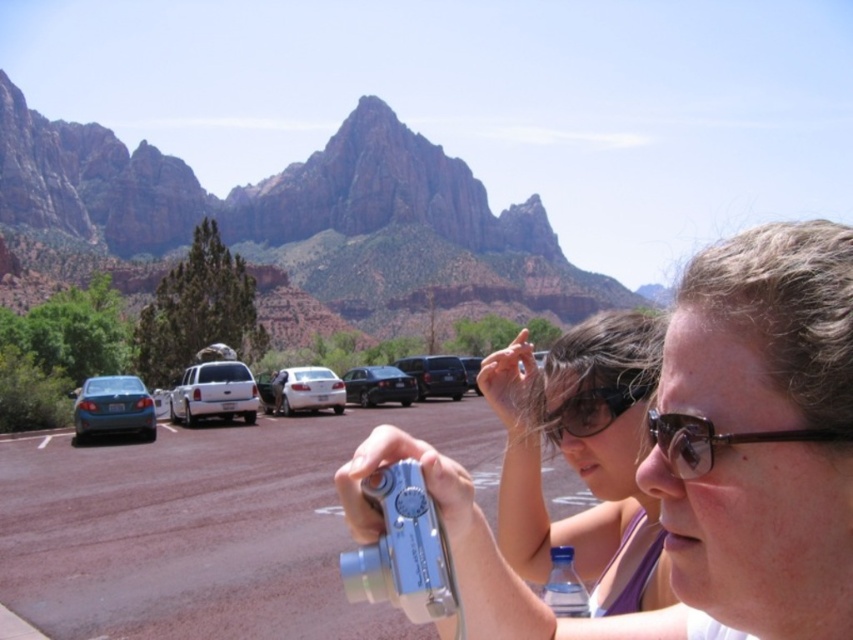
Based on the photo, you are standing in the parking area and want to take a photo of the mountain range using the metallic silver camera at center. Where should you position the camera to ensure the mountains are in the frame?

The metallic silver camera at center is already positioned at point (706, 458), which is the optimal location for capturing the mountain range in the frame.

You are a photographer trying to set up your equipment. You have a metallic silver camera at center and brown plastic glasses at center. Which object is located to the left when looking at the scene from your perspective?

The metallic silver camera at center is positioned on the left side of brown plastic glasses at center, so it is located to the left.

You are a photographer standing at the center of the scene. You want to place your matte black goggles at center and shiny black car at center in your photo such that the distance between them in the photo is exactly 10 meters. Given that the actual distance between them is 50.85 meters, what should be the focal length of your camera lens to achieve this? Assume the camera sensor size is 36mm and the print size is 10x10 inches viewed from 1 meter away.

The focal length required can be calculated using the formula for scaling in photography. The desired distance in the photo is 10 meters, while the actual distance is 50.85 meters. The scaling factor is 10m_actual corresponds to 10m_photo, so the ratio is 10m_photo_actual_distance. Wait, perhaps I need to think differently. Alternatively, the scaling factor is desired_distance_actual divided by desired_distance_photo. Wait, maybe using similar triangles or the lens formula. Hmm, perhaps the magnification is